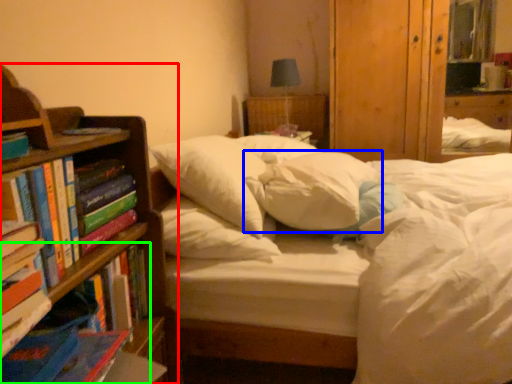
Question: Estimate the real-world distances between objects in this image. Which object is closer to bookcase (highlighted by a red box), pillow (highlighted by a blue box) or book (highlighted by a green box)?

Choices:
 (A) pillow
 (B) book

Answer: (B)